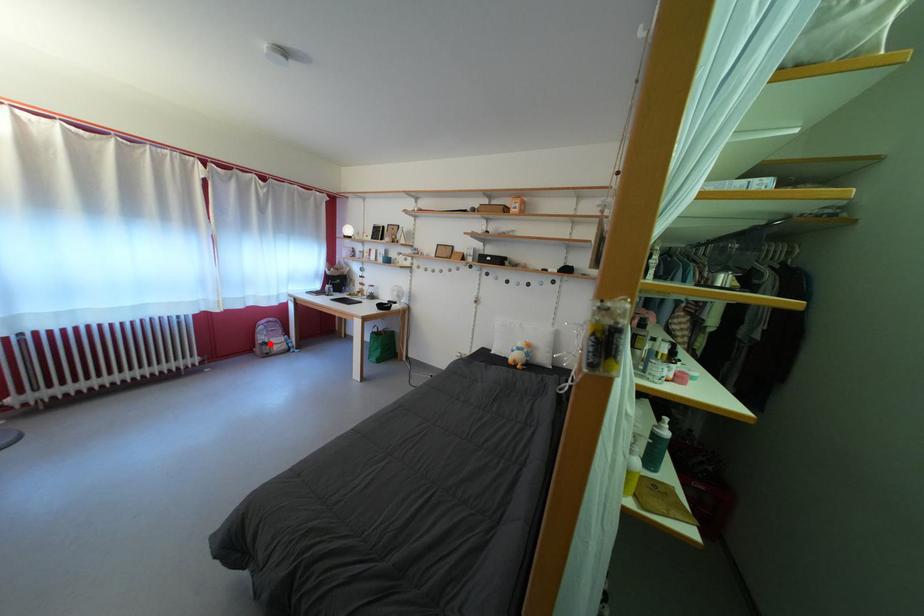
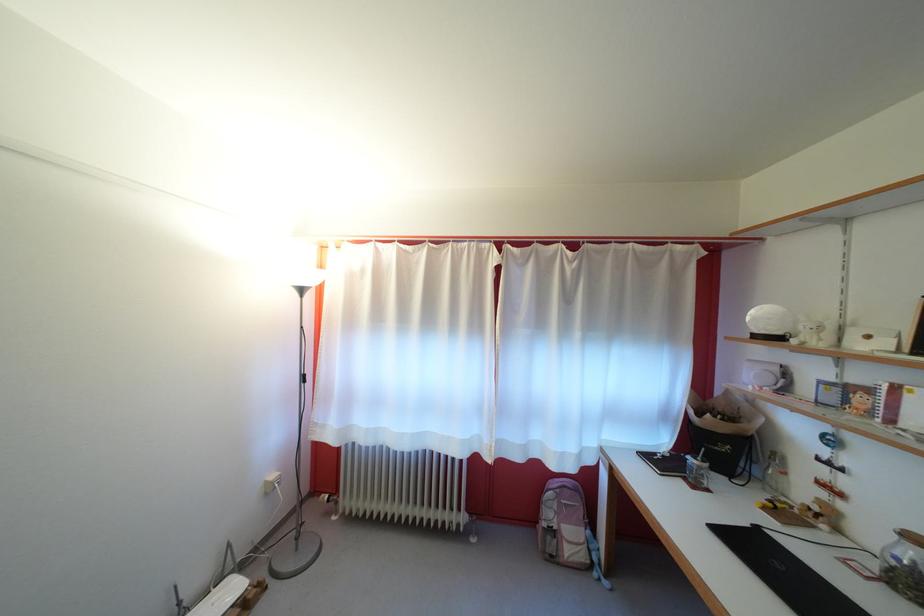
Question: I am providing you with two images of the same scene from different viewpoints. A red point is shown in image1. For the corresponding object point in image2, is it positioned nearer or farther from the camera?

Choices:
 (A) Nearer
 (B) Farther

Answer: (B)